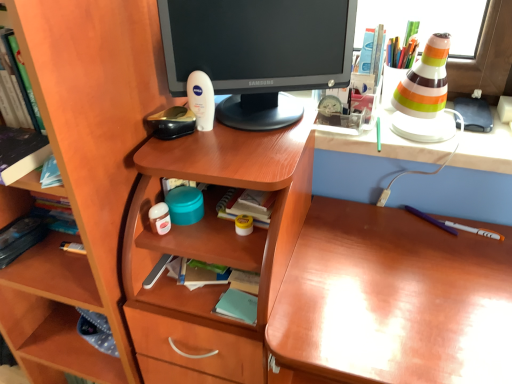
Question: Does hardcover book at left, the third book from the right, lie behind light blue paper at center, positioned as the second book in front-to-back order?

Choices:
 (A) yes
 (B) no

Answer: (A)

Question: Considering the relative positions of hardcover book at left, the 2th book from the bottom, and light blue paper at center, positioned as the second book in front-to-back order, in the image provided, is hardcover book at left, the 2th book from the bottom, to the left of light blue paper at center, positioned as the second book in front-to-back order, from the viewer's perspective?

Choices:
 (A) no
 (B) yes

Answer: (B)

Question: Could light blue paper at center, the third book positioned from the top, be considered to be inside hardcover book at left, placed as the 1th book when sorted from left to right?

Choices:
 (A) no
 (B) yes

Answer: (A)

Question: Does hardcover book at left, placed as the 1th book when sorted from left to right, have a greater width compared to light blue paper at center, positioned as the second book in front-to-back order?

Choices:
 (A) no
 (B) yes

Answer: (B)

Question: Is hardcover book at left, the 2th book from the bottom, facing away from light blue paper at center, the first book positioned from the right?

Choices:
 (A) no
 (B) yes

Answer: (A)

Question: Considering the positions of hardcover book at left, which is the 1th book from back to front, and white glossy cone at upper right in the image, is hardcover book at left, which is the 1th book from back to front, wider or thinner than white glossy cone at upper right?

Choices:
 (A) thin
 (B) wide

Answer: (A)

Question: Is hardcover book at left, which appears as the 2th book when viewed from the top, spatially inside white glossy cone at upper right, or outside of it?

Choices:
 (A) outside
 (B) inside

Answer: (A)

Question: In the image, is hardcover book at left, the third book from the right, positioned in front of or behind white glossy cone at upper right?

Choices:
 (A) front
 (B) behind

Answer: (B)

Question: From the image's perspective, is hardcover book at left, placed as the 1th book when sorted from left to right, positioned above or below white glossy cone at upper right?

Choices:
 (A) below
 (B) above

Answer: (A)

Question: Considering their positions, is light blue paper at center, which is the third book in left-to-right order, located in front of or behind matte black monitor at center?

Choices:
 (A) front
 (B) behind

Answer: (B)

Question: Is light blue paper at center, which is the third book in left-to-right order, taller or shorter than matte black monitor at center?

Choices:
 (A) tall
 (B) short

Answer: (B)

Question: Visually, is light blue paper at center, which is the first book in bottom-to-top order, positioned to the left or to the right of matte black monitor at center?

Choices:
 (A) left
 (B) right

Answer: (A)

Question: Do you think light blue paper at center, the third book positioned from the top, is within matte black monitor at center, or outside of it?

Choices:
 (A) outside
 (B) inside

Answer: (A)

Question: From the image's perspective, is matte black monitor at center above or below hardcover book at left, the 1th book in the front-to-back sequence?

Choices:
 (A) below
 (B) above

Answer: (B)

Question: Based on their sizes in the image, would you say matte black monitor at center is bigger or smaller than hardcover book at left, arranged as the second book when viewed from the right?

Choices:
 (A) small
 (B) big

Answer: (B)